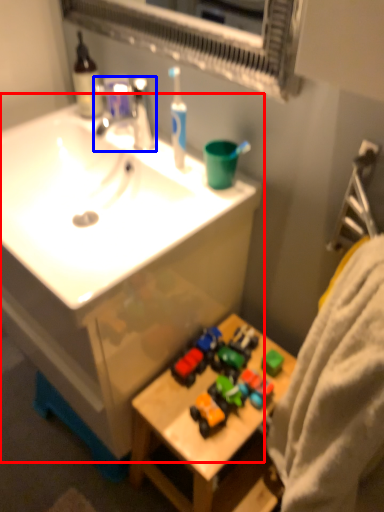
Question: Among these objects, which one is farthest to the camera, sink (highlighted by a red box) or tap (highlighted by a blue box)?

Choices:
 (A) sink
 (B) tap

Answer: (B)